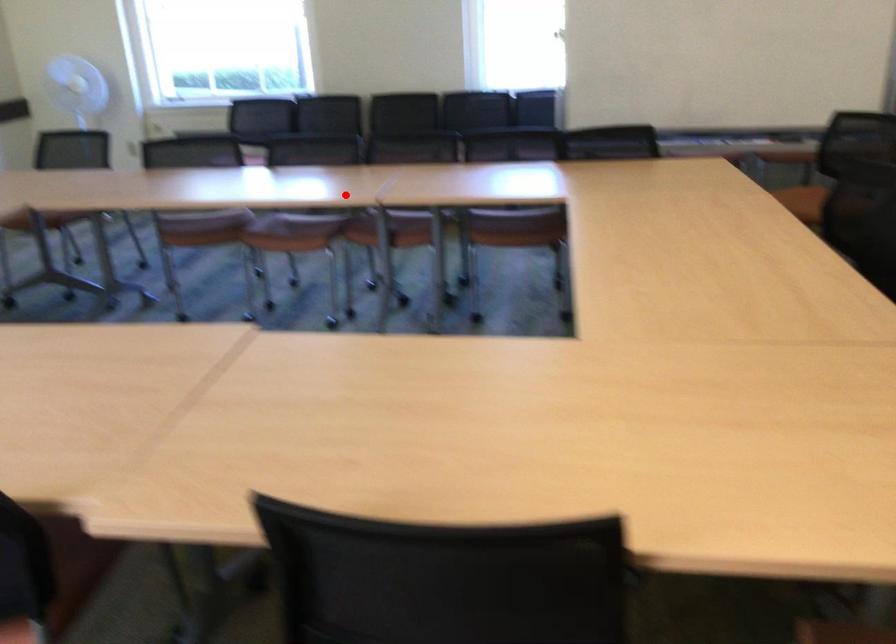
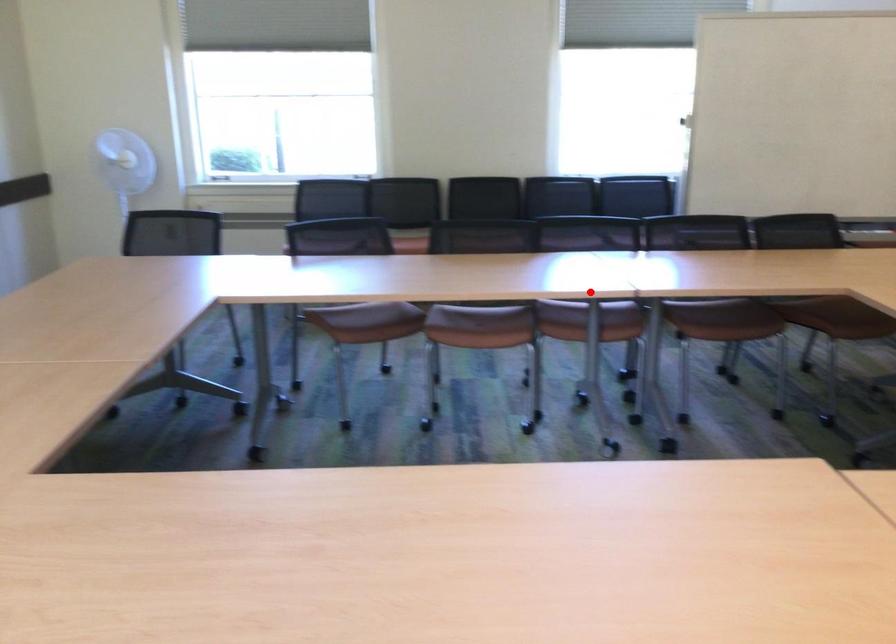
I am providing you with two images of the same scene from different viewpoints. A red point is marked on the first image and another point is marked on the second image. Do the highlighted points in image1 and image2 indicate the same real-world spot?

Yes